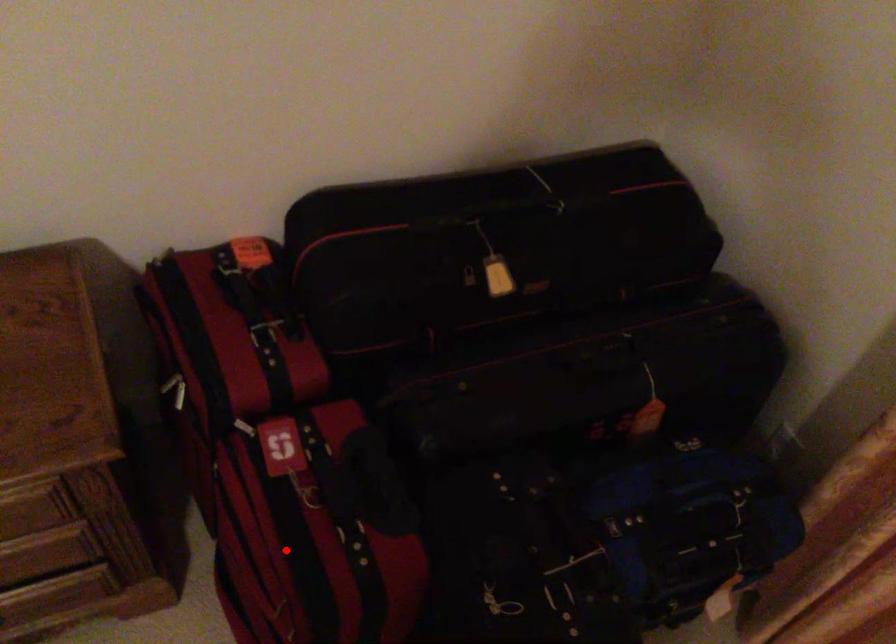
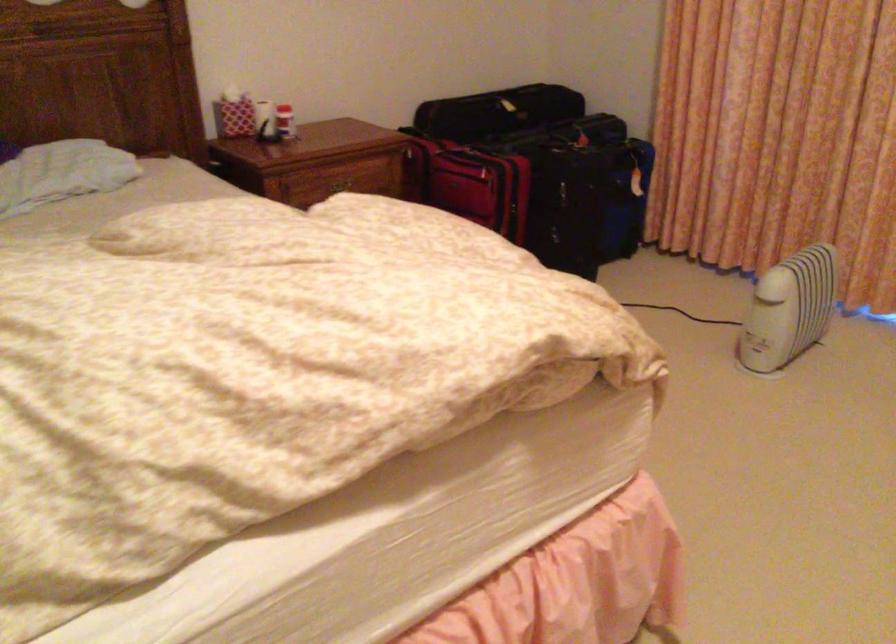
Question: I am providing you with two images of the same scene from different viewpoints. A red point is shown in image1. For the corresponding object point in image2, is it positioned nearer or farther from the camera?

Choices:
 (A) Nearer
 (B) Farther

Answer: (B)